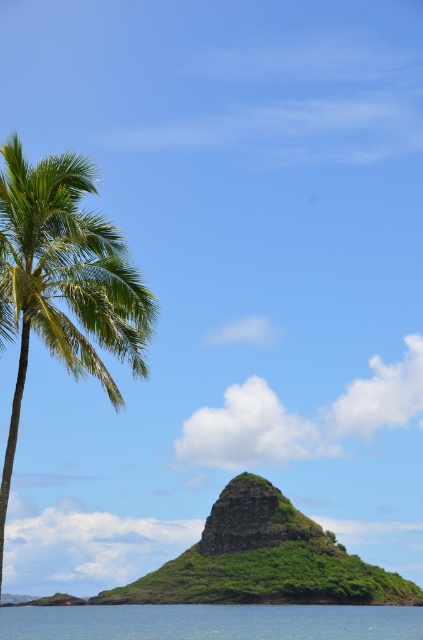
Question: Estimate the real-world distances between objects in this image. Which object is farther from the green grassy rock at center?

Choices:
 (A) green leafy palm tree at left
 (B) blue water at lower center

Answer: (A)

Question: Is green leafy palm tree at left below blue water at lower center?

Choices:
 (A) yes
 (B) no

Answer: (B)

Question: Is green leafy palm tree at left positioned before blue water at lower center?

Choices:
 (A) yes
 (B) no

Answer: (A)

Question: Can you confirm if green leafy palm tree at left is positioned to the left of green grassy rock at center?

Choices:
 (A) yes
 (B) no

Answer: (A)

Question: Which point is closer to the camera taking this photo?

Choices:
 (A) (3, 244)
 (B) (242, 493)

Answer: (A)

Question: Which of the following is the farthest from the observer?

Choices:
 (A) blue water at lower center
 (B) green leafy palm tree at left
 (C) green grassy rock at center

Answer: (C)